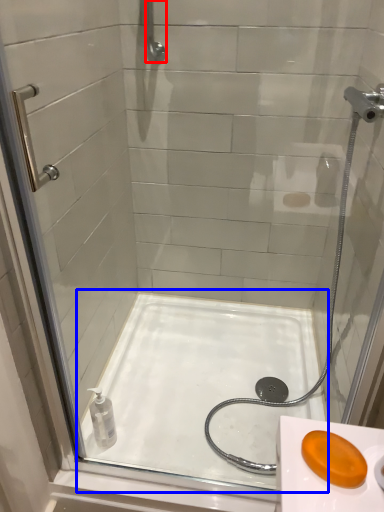
Question: Which object appears closest to the camera in this image, shower (highlighted by a red box) or bath (highlighted by a blue box)?

Choices:
 (A) shower
 (B) bath

Answer: (B)